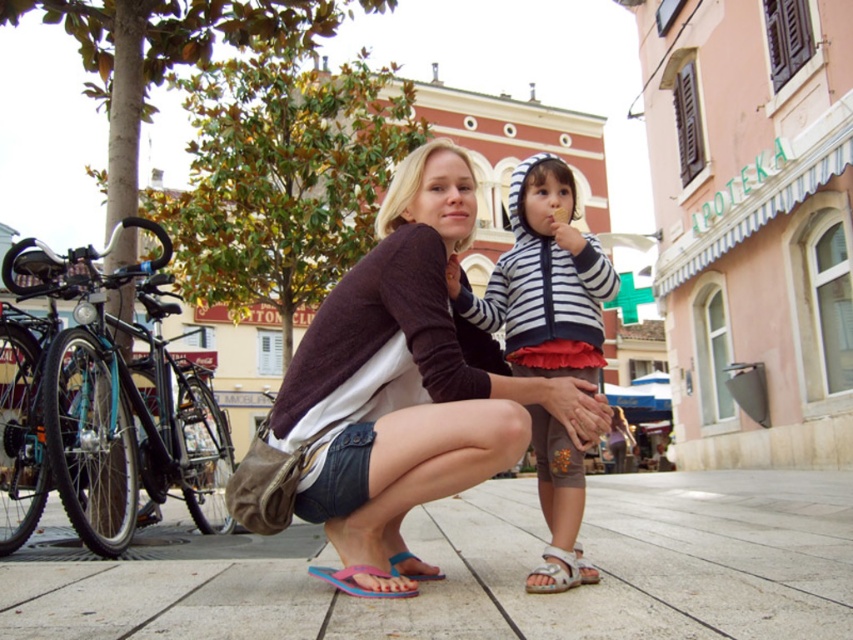
From the picture: You are a photographer trying to capture a candid shot of the dark purple sweater at center and the beige fabric sandal at lower center. Which object should you focus on first to ensure both are in frame?

The dark purple sweater at center is in front of the beige fabric sandal at lower center, so you should focus on the dark purple sweater at center first to ensure both are in frame.

You are a photographer trying to capture a closeup shot of the dark purple sweater at center. The camera you are using has a focal length of 50mm. Given that the sweater is at coordinates point 0.588, 0.479, can you determine if the sweater will be in the center of the image?

The dark purple sweater at center is positioned at point [408,376], which is slightly offset from the exact center coordinates of [426,320]. Therefore, the sweater will be near the center but not exactly in the middle of the image.